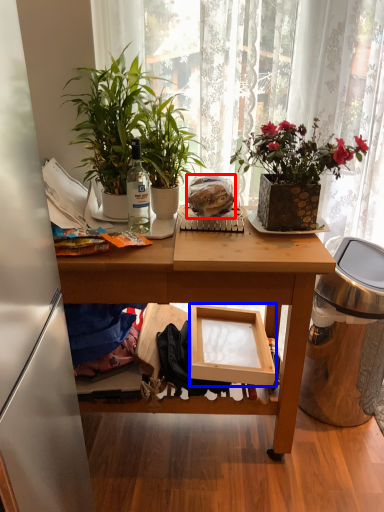
Question: Which of the following is the farthest to the observer, food (highlighted by a red box) or box (highlighted by a blue box)?

Choices:
 (A) food
 (B) box

Answer: (B)